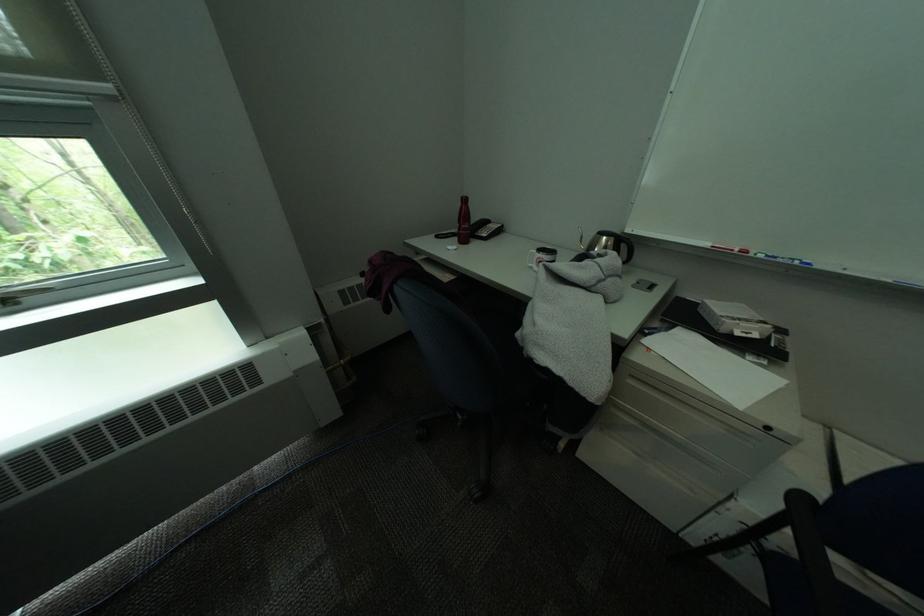
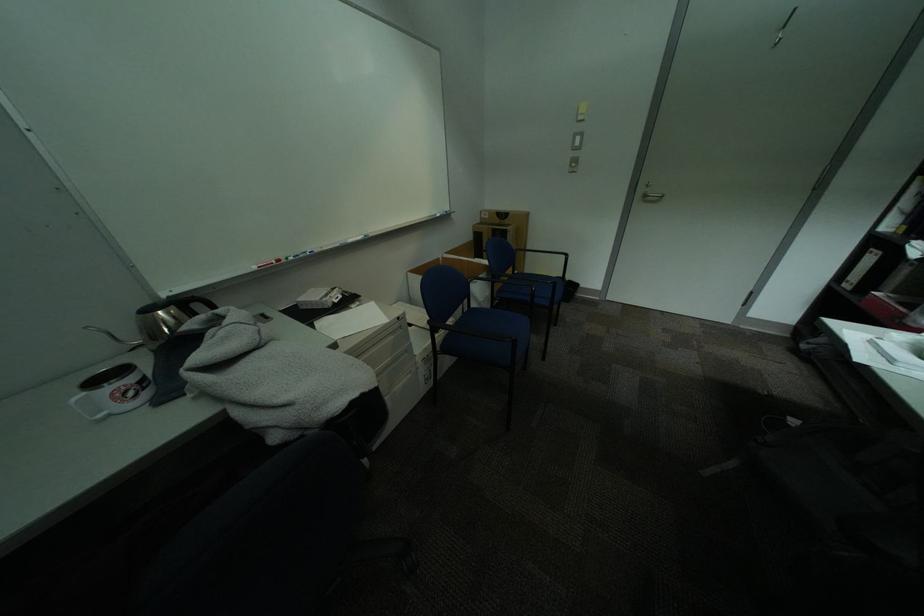
Where in the second image is the point corresponding to point (542, 254) from the first image?

(90, 400)